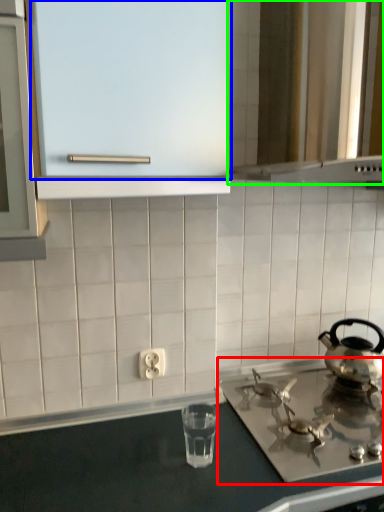
Question: Based on their relative distances, which object is nearer to gas stove (highlighted by a red box)? Choose from glass door (highlighted by a blue box) and vent (highlighted by a green box).

Choices:
 (A) glass door
 (B) vent

Answer: (B)